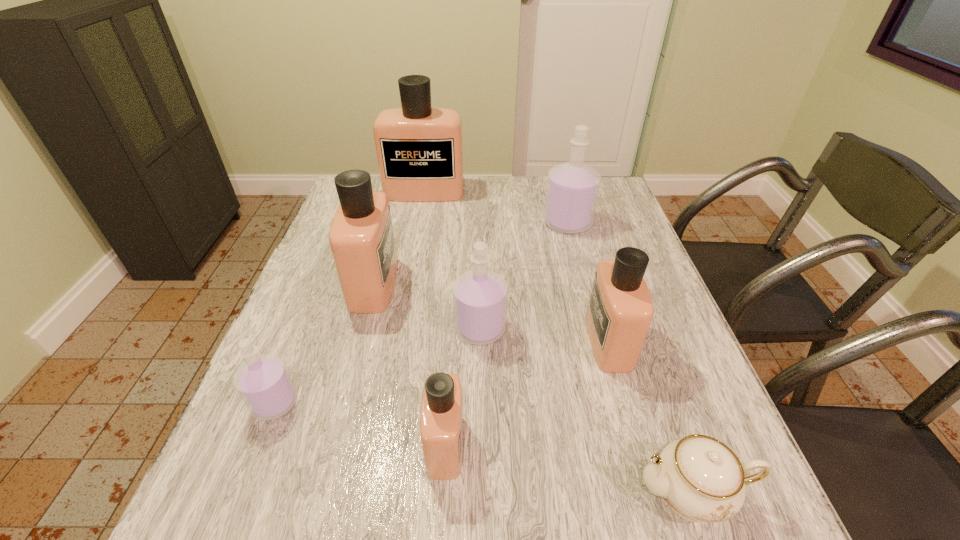
At what (x,y) coordinates should I click in order to perform the action: click on blank space that satisfies the following two spatial constraints: 1. on the front side of the second farthest perfume; 2. on the front label of the nearest beige perfume. Please return your answer as a coordinate pair (x, y). The width and height of the screenshot is (960, 540). Looking at the image, I should click on (626, 444).

Locate an element on the screen. The width and height of the screenshot is (960, 540). vacant space that satisfies the following two spatial constraints: 1. on the back side of the rightmost purple perfume; 2. on the right side of the second smallest purple perfume is located at coordinates [x=480, y=223].